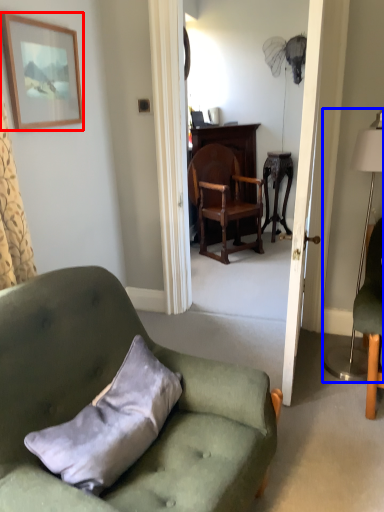
Question: Among these objects, which one is farthest to the camera, picture frame (highlighted by a red box) or lamp (highlighted by a blue box)?

Choices:
 (A) picture frame
 (B) lamp

Answer: (A)